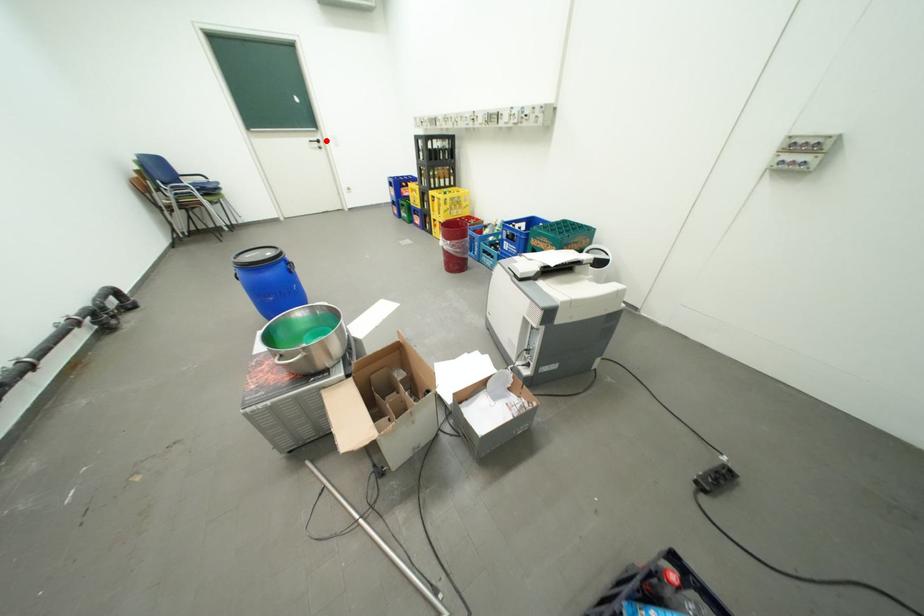
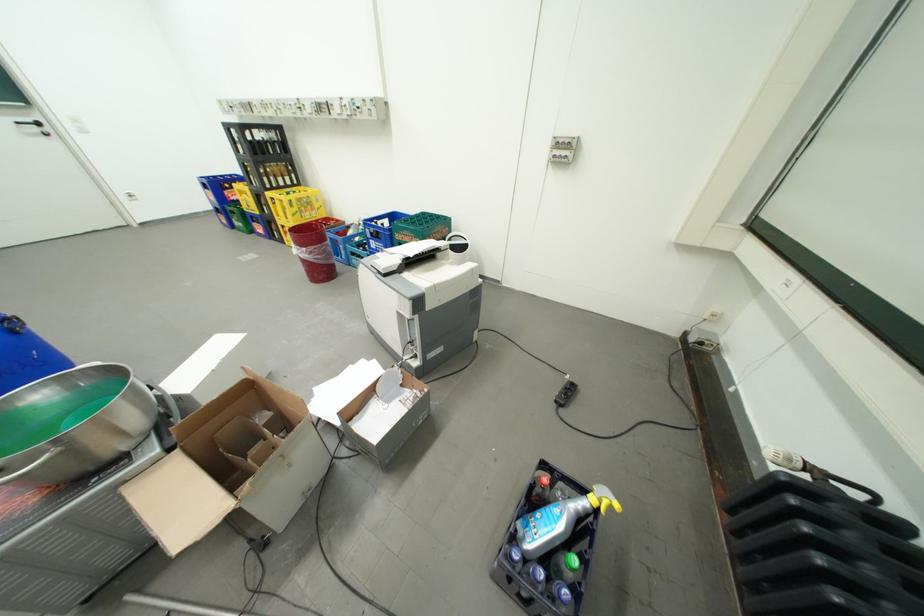
Question: A red point is marked in image1. In image2, is the corresponding 3D point closer to the camera or farther? Reply with the corresponding letter.

Choices:
 (A) The corresponding 3D point is closer.
 (B) The corresponding 3D point is farther.

Answer: (B)